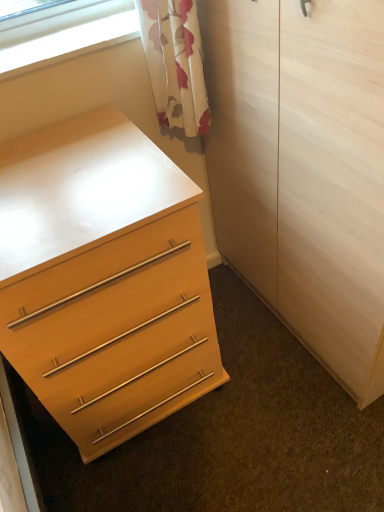
Question: Is clear glass window at upper left wider than matte wood chest of drawers at lower left?

Choices:
 (A) yes
 (B) no

Answer: (B)

Question: Is matte wood chest of drawers at lower left inside clear glass window at upper left?

Choices:
 (A) no
 (B) yes

Answer: (A)

Question: Is clear glass window at upper left aimed at matte wood chest of drawers at lower left?

Choices:
 (A) yes
 (B) no

Answer: (B)

Question: Would you say clear glass window at upper left is a long distance from matte wood chest of drawers at lower left?

Choices:
 (A) no
 (B) yes

Answer: (A)

Question: From the image's perspective, would you say clear glass window at upper left is positioned over matte wood chest of drawers at lower left?

Choices:
 (A) no
 (B) yes

Answer: (B)

Question: Looking at their shapes, would you say light wood/texture armoire at center is wider or thinner than clear glass window at upper left?

Choices:
 (A) thin
 (B) wide

Answer: (B)

Question: Considering the relative positions of light wood/texture armoire at center and clear glass window at upper left in the image provided, is light wood/texture armoire at center to the left or to the right of clear glass window at upper left?

Choices:
 (A) left
 (B) right

Answer: (B)

Question: In the image, is light wood/texture armoire at center positioned in front of or behind clear glass window at upper left?

Choices:
 (A) behind
 (B) front

Answer: (B)

Question: Is light wood/texture armoire at center taller or shorter than clear glass window at upper left?

Choices:
 (A) tall
 (B) short

Answer: (A)

Question: Is matte wood chest of drawers at lower left to the left or to the right of clear glass window at upper left in the image?

Choices:
 (A) left
 (B) right

Answer: (B)

Question: Looking at the image, does matte wood chest of drawers at lower left seem bigger or smaller compared to clear glass window at upper left?

Choices:
 (A) big
 (B) small

Answer: (A)

Question: Is matte wood chest of drawers at lower left taller or shorter than clear glass window at upper left?

Choices:
 (A) short
 (B) tall

Answer: (B)

Question: From the image's perspective, is matte wood chest of drawers at lower left positioned above or below clear glass window at upper left?

Choices:
 (A) above
 (B) below

Answer: (B)

Question: In terms of size, does matte wood chest of drawers at lower left appear bigger or smaller than light wood/texture armoire at center?

Choices:
 (A) big
 (B) small

Answer: (B)

Question: Is matte wood chest of drawers at lower left in front of or behind light wood/texture armoire at center in the image?

Choices:
 (A) front
 (B) behind

Answer: (B)